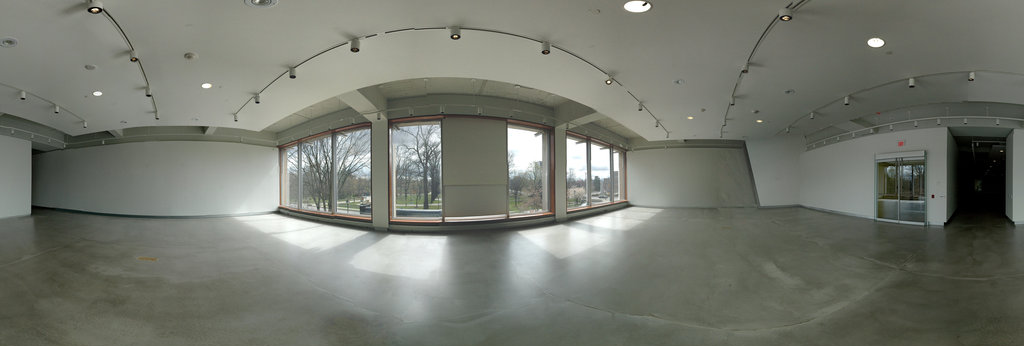
The width and height of the screenshot is (1024, 346). In order to click on left baseboard in hall in this screenshot , I will do `click(952, 217)`.